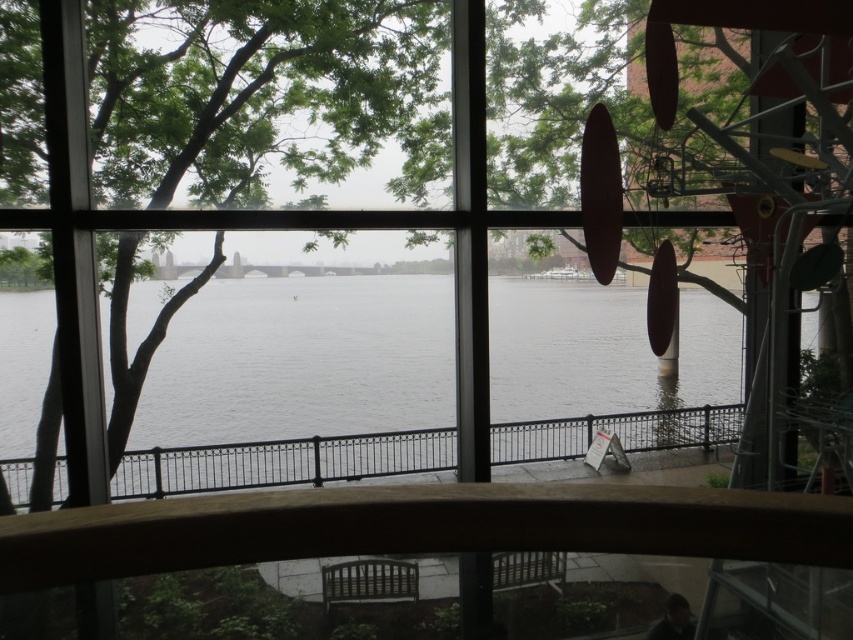
You are standing on the observation deck and want to know the distance to the point marked at coordinates point (x=366, y=426). Can you determine how far it is?

The point (x=366, y=426) is 12.55 meters away from the viewer.

You are designing a virtual tour of this riverside area. To ensure visitors can see both the gray water at center and the black metal railing at center clearly, you need to adjust the camera angle so that both objects are fully visible. Given their relative sizes, which object should you prioritize keeping in the frame first?

The gray water at center is wider than the black metal railing at center. Therefore, you should prioritize keeping the gray water at center in the frame first since it requires more space to be fully visible.